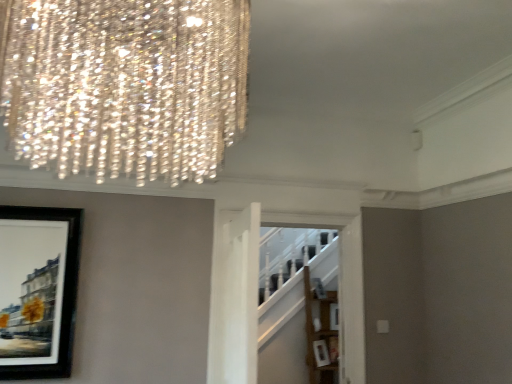
Image resolution: width=512 pixels, height=384 pixels. Find the location of `black matte picture frame at left`. black matte picture frame at left is located at coordinates (38, 290).

What do you see at coordinates (38, 290) in the screenshot? The width and height of the screenshot is (512, 384). I see `black matte picture frame at left` at bounding box center [38, 290].

Locate an element on the screen. This screenshot has height=384, width=512. wooden shelf at center is located at coordinates (320, 332).

The width and height of the screenshot is (512, 384). Describe the element at coordinates (320, 332) in the screenshot. I see `wooden shelf at center` at that location.

Find the location of a particular element. black matte picture frame at left is located at coordinates (38, 290).

Which is more to the right, wooden shelf at center or black matte picture frame at left?

wooden shelf at center is more to the right.

Is wooden shelf at center closer to the viewer compared to black matte picture frame at left?

No, it is behind black matte picture frame at left.

Considering the points (322, 298) and (28, 240), which point is in front, point (322, 298) or point (28, 240)?

Positioned in front is point (28, 240).

From the image's perspective, which one is positioned higher, wooden shelf at center or black matte picture frame at left?

black matte picture frame at left is shown above in the image.

From a real-world perspective, which is physically above, wooden shelf at center or black matte picture frame at left?

black matte picture frame at left.

Does wooden shelf at center have a greater width compared to black matte picture frame at left?

Yes.

Is wooden shelf at center shorter than black matte picture frame at left?

No.

Considering the relative sizes of wooden shelf at center and black matte picture frame at left in the image provided, is wooden shelf at center smaller than black matte picture frame at left?

Actually, wooden shelf at center might be larger than black matte picture frame at left.

Is wooden shelf at center not within black matte picture frame at left?

Yes, wooden shelf at center is located beyond the bounds of black matte picture frame at left.

Is there a large distance between wooden shelf at center and black matte picture frame at left?

Yes, wooden shelf at center and black matte picture frame at left are quite far apart.

Is wooden shelf at center facing towards black matte picture frame at left?

No, wooden shelf at center is not aimed at black matte picture frame at left.

What's the angular difference between wooden shelf at center and black matte picture frame at left's facing directions?

The angle between the facing direction of wooden shelf at center and the facing direction of black matte picture frame at left is 0.351 degrees.

Locate an element on the screen. The width and height of the screenshot is (512, 384). picture frame positioned vertically above the wooden shelf at center (from a real-world perspective) is located at coordinates (38, 290).

Can you confirm if black matte picture frame at left is positioned to the right of wooden shelf at center?

Incorrect, black matte picture frame at left is not on the right side of wooden shelf at center.

Relative to wooden shelf at center, is black matte picture frame at left in front or behind?

Visually, black matte picture frame at left is located in front of wooden shelf at center.

Between point (46, 362) and point (308, 272), which one is positioned in front?

The point (46, 362) is more forward.

From the image's perspective, is black matte picture frame at left located above or below wooden shelf at center?

From the image's perspective, black matte picture frame at left appears above wooden shelf at center.

From a real-world perspective, who is located higher, black matte picture frame at left or wooden shelf at center?

black matte picture frame at left, from a real-world perspective.

Which object is thinner, black matte picture frame at left or wooden shelf at center?

With smaller width is black matte picture frame at left.

From their relative heights in the image, would you say black matte picture frame at left is taller or shorter than wooden shelf at center?

Considering their sizes, black matte picture frame at left has less height than wooden shelf at center.

Considering the relative sizes of black matte picture frame at left and wooden shelf at center in the image provided, is black matte picture frame at left bigger than wooden shelf at center?

No.

Consider the image. Is black matte picture frame at left inside the boundaries of wooden shelf at center, or outside?

black matte picture frame at left cannot be found inside wooden shelf at center.

Is black matte picture frame at left with wooden shelf at center?

No, black matte picture frame at left is not beside wooden shelf at center.

Is black matte picture frame at left aimed at wooden shelf at center?

No, black matte picture frame at left is not facing towards wooden shelf at center.

How many degrees apart are the facing directions of black matte picture frame at left and wooden shelf at center?

black matte picture frame at left and wooden shelf at center are facing 0.351 degrees away from each other.

Where is `picture frame that appears on the left of wooden shelf at center`? picture frame that appears on the left of wooden shelf at center is located at coordinates [x=38, y=290].

Identify the location of shelf lying on the right of black matte picture frame at left. (320, 332).

I want to click on picture frame lying in front of the wooden shelf at center, so click(x=38, y=290).